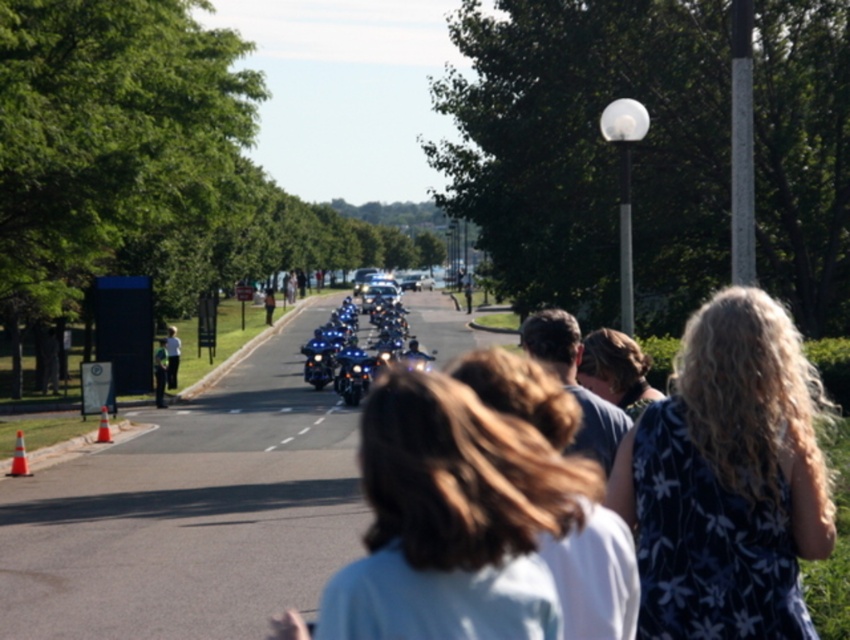
You are a photographer standing at the camera position. You want to capture a closeup shot of the shiny blue motorcycle at center. The camera lens you have can focus on objects up to 30 meters away. Can you take the photo without moving closer?

The shiny blue motorcycle at center is 33.72 meters away from the camera. Since the maximum focus distance of your lens is 30 meters, you cannot take the photo without moving closer because the motorcycle is beyond the lens range.

You are a photographer standing at the point marked by the coordinates [728,480] in the image. You want to take a picture of the motorcycles in the motorcade procession. Which direction should you move to get a better view of the motorcycles?

The point marked by the coordinates [728,480] is on the dark floral dress at center. To get a better view of the motorcycles, you should move away from the dark floral dress at center towards the road where the motorcycles are driving.

You are a pedestrian standing on the sidewalk observing the motorcade. The shiny chrome motorcycle at center and the white dashed line at center are both visible in your view. Which object is positioned higher in the image?

The shiny chrome motorcycle at center is located above the white dashed line at center, so it is positioned higher in the image.